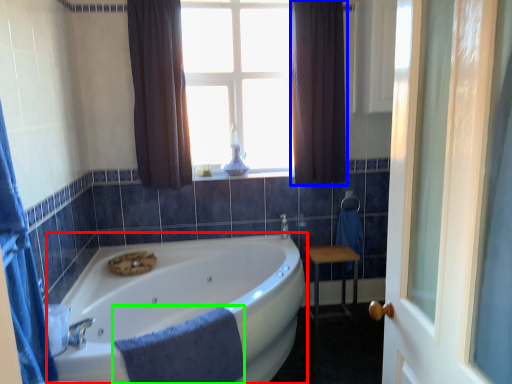
Question: Which object is the farthest from bathtub (highlighted by a red box)? Choose among these: curtain (highlighted by a blue box) or bath towel (highlighted by a green box).

Choices:
 (A) curtain
 (B) bath towel

Answer: (A)